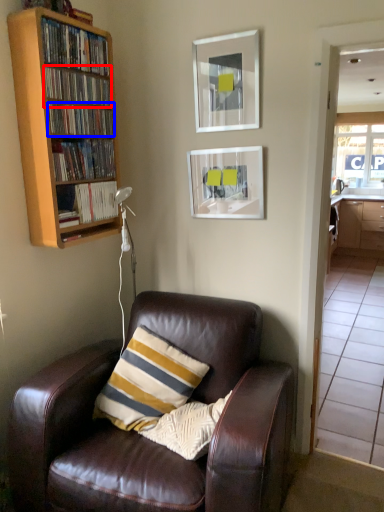
Question: Among these objects, which one is nearest to the camera, book (highlighted by a red box) or book (highlighted by a blue box)?

Choices:
 (A) book
 (B) book

Answer: (A)